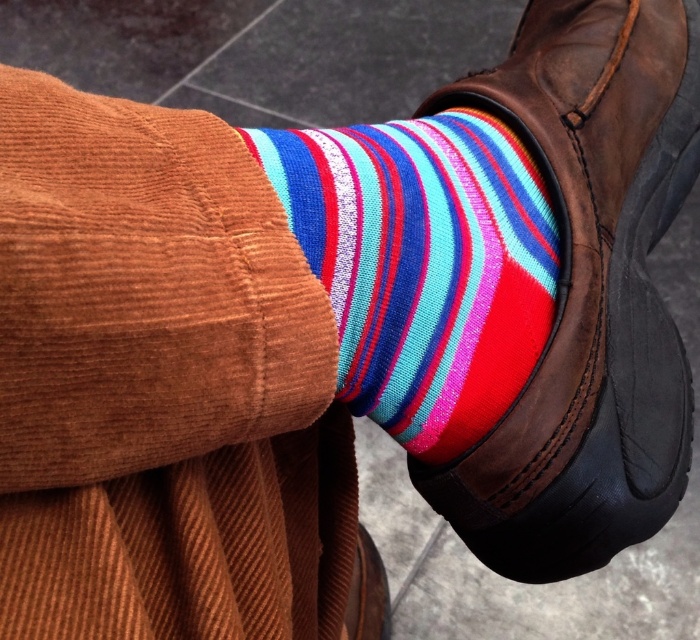
You are a photographer trying to capture the multicolored knitted sock at center and the leather boot at center in focus. Since you can only focus on one object at a time, which one should you choose to ensure it appears sharp in the photo?

The leather boot at center is closer to the viewer than the multicolored knitted sock at center, so focusing on the leather boot at center will keep it sharp while the sock may appear slightly blurred. Alternatively, focusing on the sock might leave the boot out of focus. To have one in focus, prioritize the leather boot at center as it is nearer.

You need to put on your leather boot at center over your multicolored knitted sock at center. Will the sock fit inside the boot without bunching up?

The leather boot at center might be wider than the multicolored knitted sock at center, so there should be enough space for the sock to fit inside without bunching up.